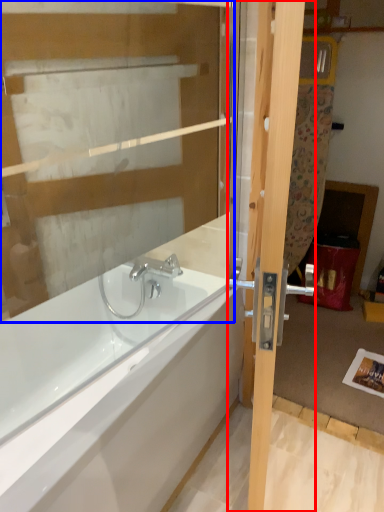
Question: Among these objects, which one is nearest to the camera, door (highlighted by a red box) or glass door (highlighted by a blue box)?

Choices:
 (A) door
 (B) glass door

Answer: (A)